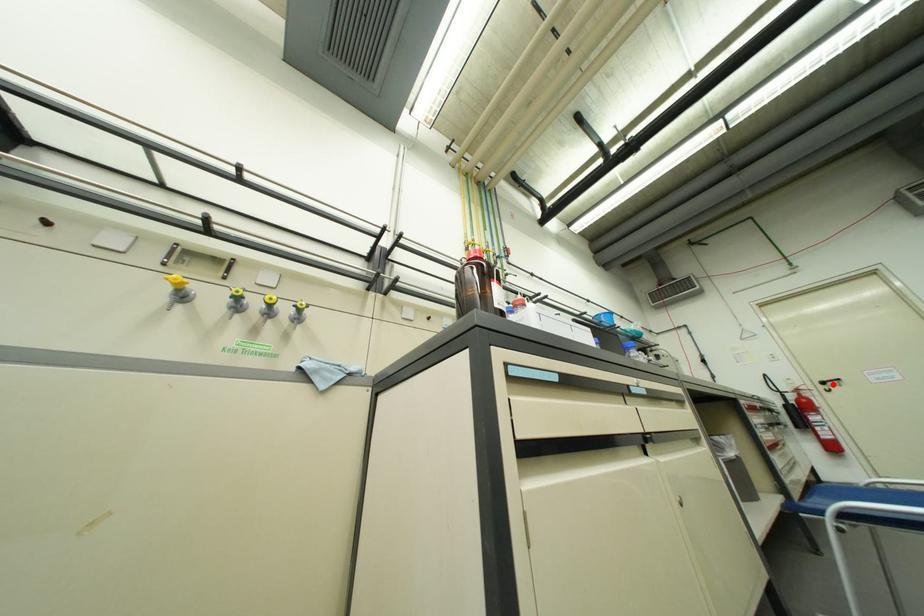
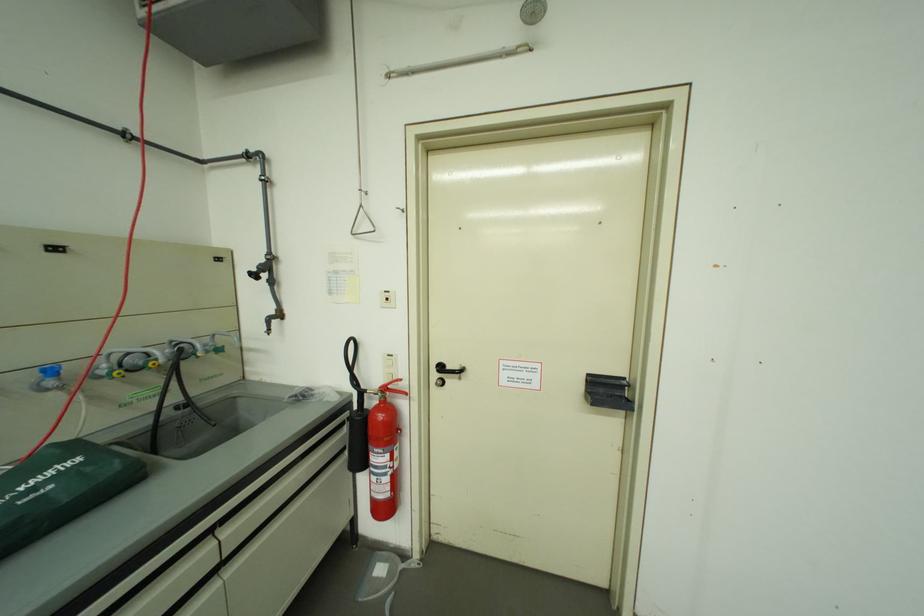
Where in the second image is the point corresponding to the highlighted location from the first image?

(451, 369)